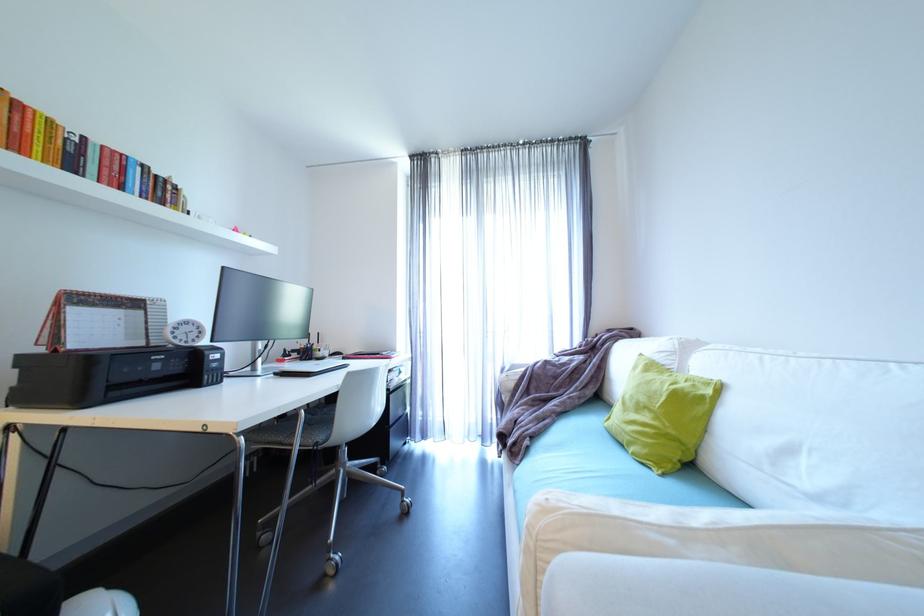
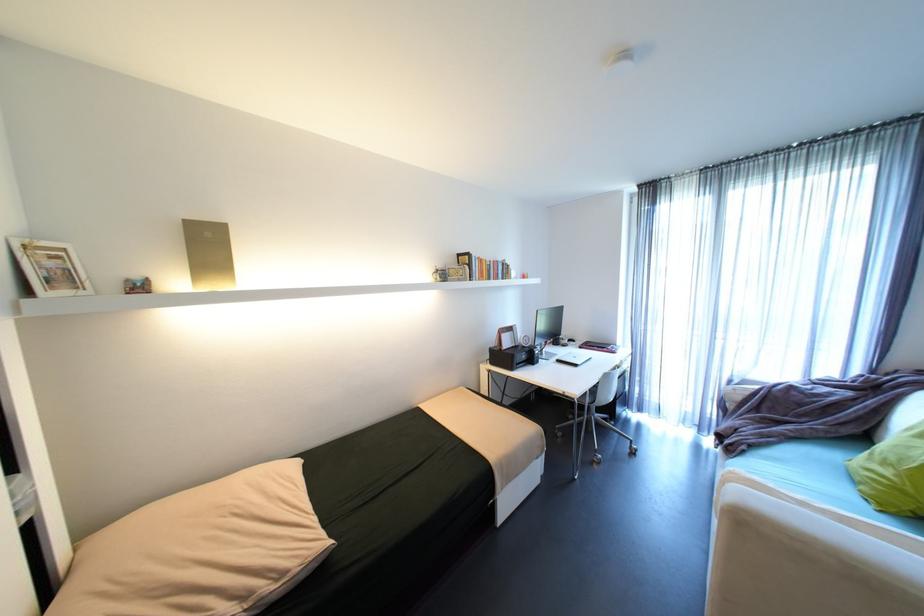
Locate, in the second image, the point that corresponds to point (111, 147) in the first image.

(500, 262)